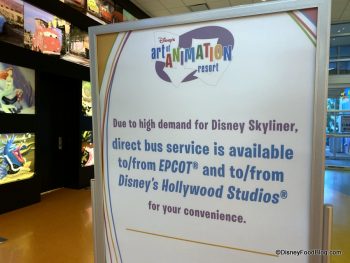
I want to click on frame, so click(321, 131).